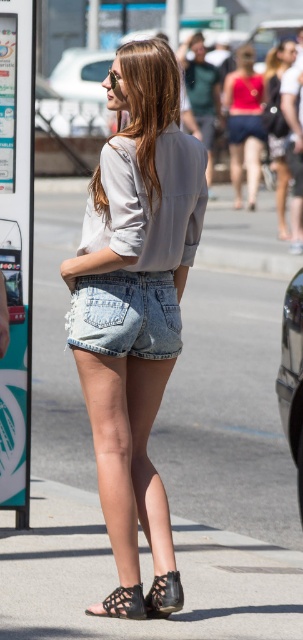
Question: Based on their relative distances, which object is nearer to the black leather sandal at lower center?

Choices:
 (A) denim shorts at center
 (B) faded denim shorts at lower center
 (C) black woven sandal at lower center

Answer: (C)

Question: Which point is farther to the camera?

Choices:
 (A) (169, 244)
 (B) (165, 348)

Answer: (B)

Question: Can you confirm if faded denim shorts at lower center is positioned above matte pink tank top at upper center?

Choices:
 (A) yes
 (B) no

Answer: (B)

Question: Can you confirm if denim shorts at center is bigger than black leather sandal at lower center?

Choices:
 (A) yes
 (B) no

Answer: (A)

Question: Estimate the real-world distances between objects in this image. Which object is closer to the black leather sandal at lower center?

Choices:
 (A) matte pink tank top at upper center
 (B) faded denim shorts at lower center
 (C) denim shorts at center

Answer: (C)

Question: Can you confirm if faded denim shorts at lower center is positioned above black leather sandal at lower center?

Choices:
 (A) no
 (B) yes

Answer: (B)